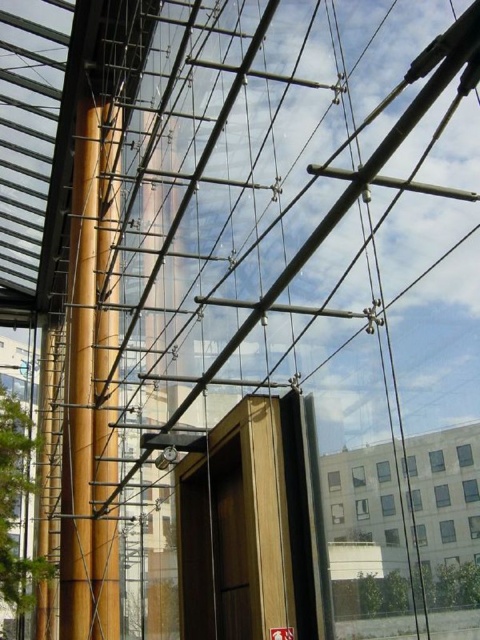
In the scene shown: Can you confirm if wooden pole at center is thinner than yellow matte pole at center?

No, wooden pole at center is not thinner than yellow matte pole at center.

Does point (83, 476) come closer to viewer compared to point (108, 410)?

That is False.

Locate an element on the screen. The width and height of the screenshot is (480, 640). wooden pole at center is located at coordinates (90, 387).